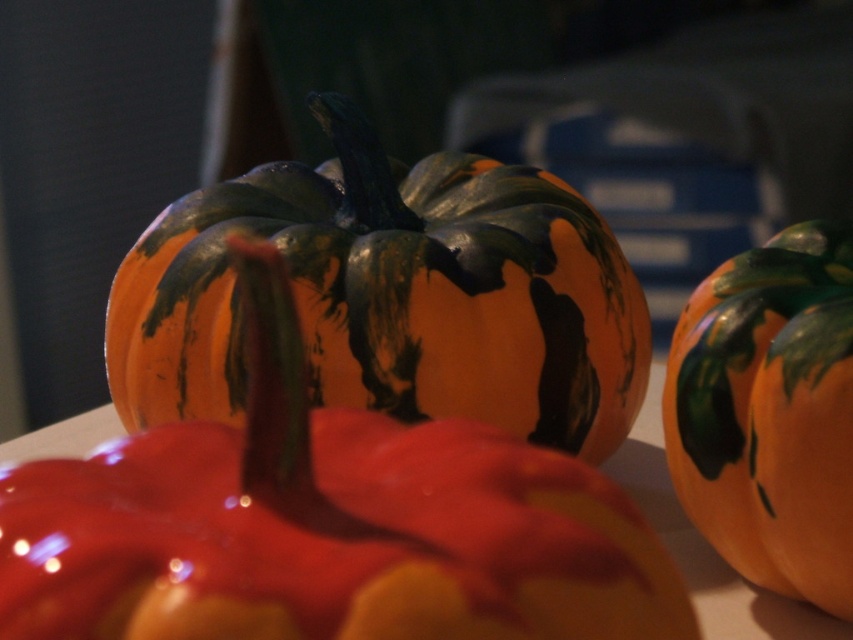
Is orange matte pumpkin at center to the left of matte orange pumpkin at center from the viewer's perspective?

In fact, orange matte pumpkin at center is to the right of matte orange pumpkin at center.

Looking at this image, between orange matte pumpkin at center and matte orange pumpkin at center, which one is positioned lower?

orange matte pumpkin at center

Between point (370, 468) and point (543, 308), which one is positioned behind?

The point (543, 308) is more distant.

You are a GUI agent. You are given a task and a screenshot of the screen. Output one action in this format:
    pyautogui.click(x=<x>, y=<y>)
    Task: Click on the orange matte pumpkin at center
    
    Given the screenshot: What is the action you would take?
    pyautogui.click(x=323, y=524)

Which is below, matte orange pumpkin at center or orange matte pumpkin at right?

orange matte pumpkin at right is below.

Can you confirm if matte orange pumpkin at center is positioned to the left of orange matte pumpkin at right?

Indeed, matte orange pumpkin at center is positioned on the left side of orange matte pumpkin at right.

Is point (479, 179) positioned after point (811, 253)?

Yes, point (479, 179) is farther from viewer.

Locate an element on the screen. The height and width of the screenshot is (640, 853). matte orange pumpkin at center is located at coordinates (392, 296).

This screenshot has height=640, width=853. What do you see at coordinates (323, 524) in the screenshot? I see `orange matte pumpkin at center` at bounding box center [323, 524].

In the scene shown: Who is positioned more to the right, orange matte pumpkin at center or orange matte pumpkin at right?

orange matte pumpkin at right is more to the right.

Identify the location of orange matte pumpkin at center. The image size is (853, 640). (323, 524).